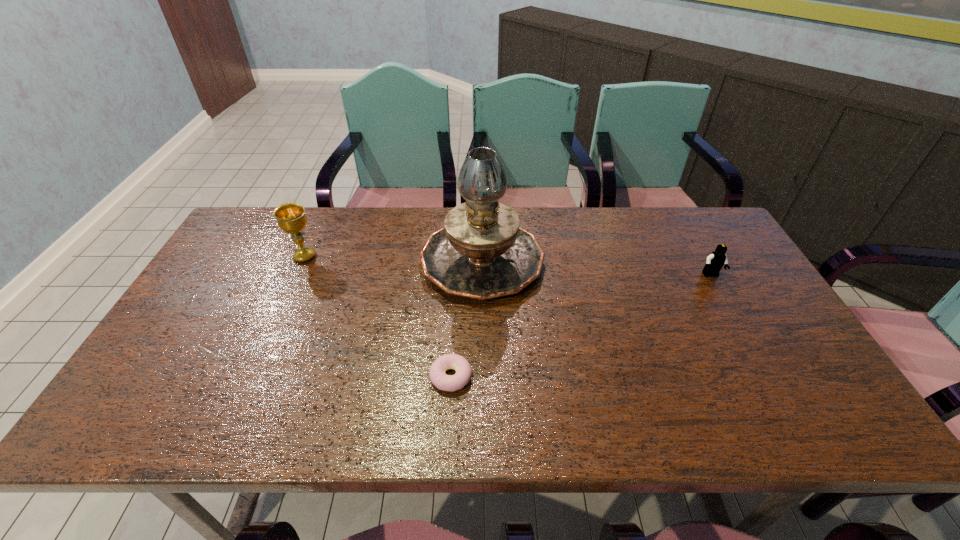
Where is `empty space between the doughnut and the second shortest object`? Image resolution: width=960 pixels, height=540 pixels. empty space between the doughnut and the second shortest object is located at coordinates (581, 326).

This screenshot has width=960, height=540. Identify the location of free space between the second shortest object and the tallest object. (596, 267).

Locate an element on the screen. This screenshot has height=540, width=960. free space between the second tallest object and the oil lamp is located at coordinates (394, 258).

Locate an element on the screen. Image resolution: width=960 pixels, height=540 pixels. vacant area that lies between the tallest object and the shortest object is located at coordinates (467, 318).

Locate an element on the screen. unoccupied position between the Lego and the tallest object is located at coordinates (596, 267).

The image size is (960, 540). I want to click on vacant space in between the oil lamp and the doughnut, so click(x=467, y=318).

In order to click on vacant area that lies between the nearest object and the leftmost object in this screenshot , I will do click(378, 316).

Where is `vacant point located between the Lego and the nearest object`? vacant point located between the Lego and the nearest object is located at coordinates (581, 326).

Find the location of a particular element. free spot between the third shortest object and the nearest object is located at coordinates (378, 316).

Identify which object is the second nearest to the tallest object. Please provide its 2D coordinates. Your answer should be formatted as a tuple, i.e. [(x, y)], where the tuple contains the x and y coordinates of a point satisfying the conditions above.

[(291, 218)]